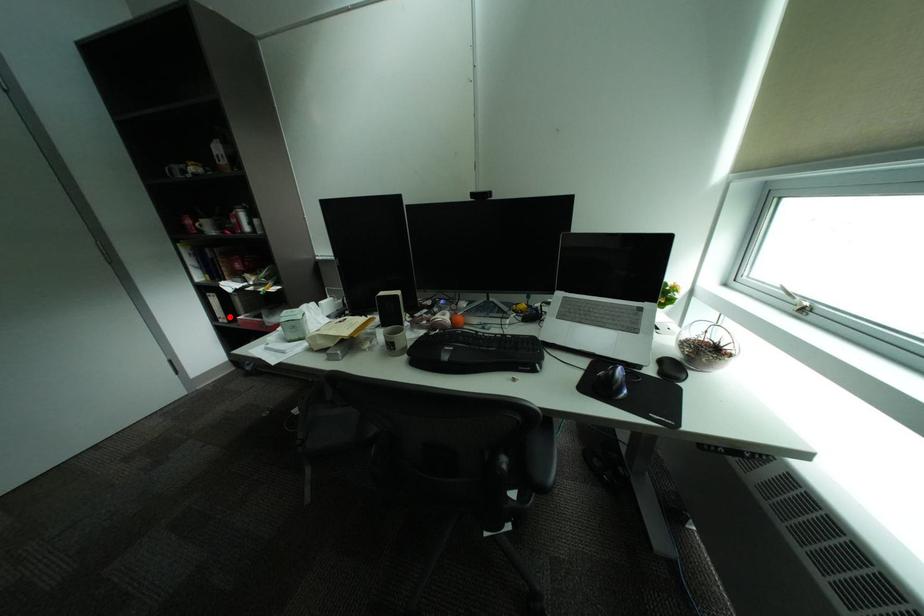
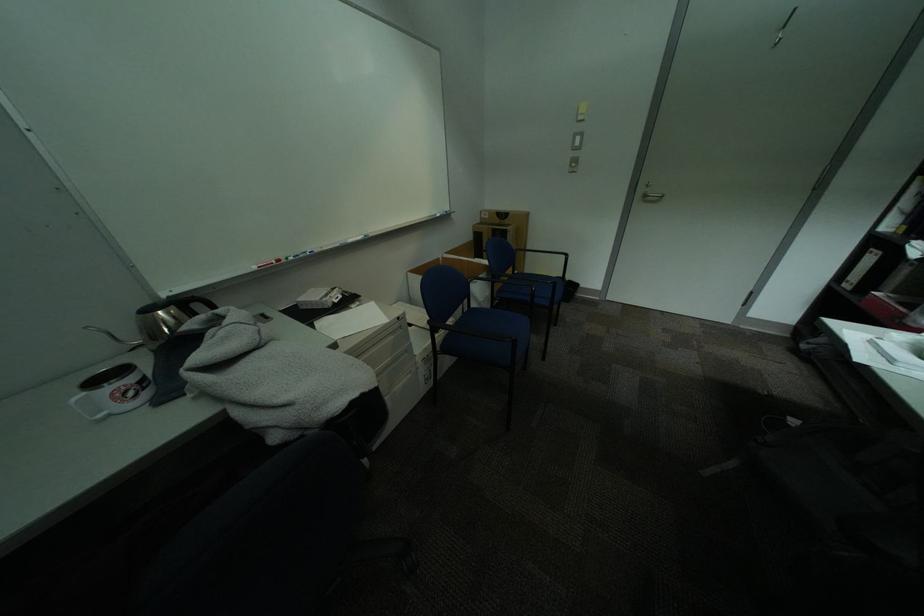
Locate, in the second image, the point that corresponds to the highlighted location in the first image.

(859, 280)